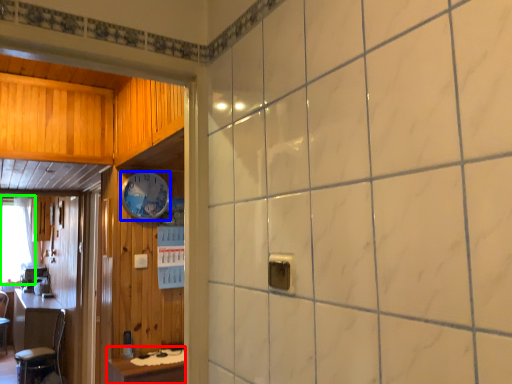
Question: Which object is the farthest from table (highlighted by a red box)? Choose among these: clock (highlighted by a blue box) or window (highlighted by a green box).

Choices:
 (A) clock
 (B) window

Answer: (B)